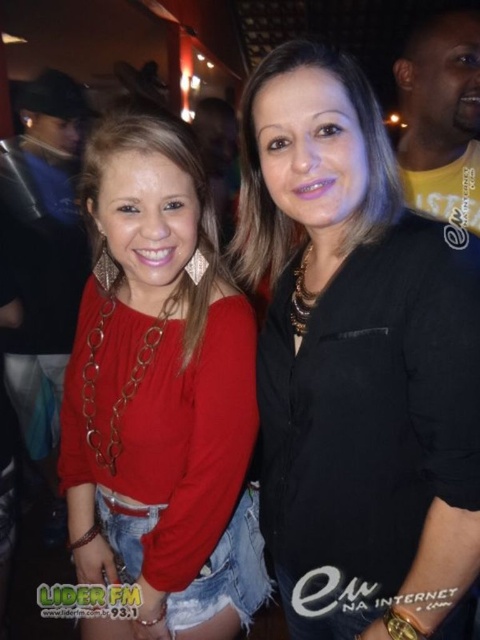
Who is lower down, black matte shirt at center or matte red blouse at center?

matte red blouse at center

Which is more to the right, black matte shirt at center or matte red blouse at center?

Positioned to the right is black matte shirt at center.

Who is more forward, [479,404] or [260,580]?

Point [479,404] is more forward.

Where is `black matte shirt at center`? black matte shirt at center is located at coordinates (356, 358).